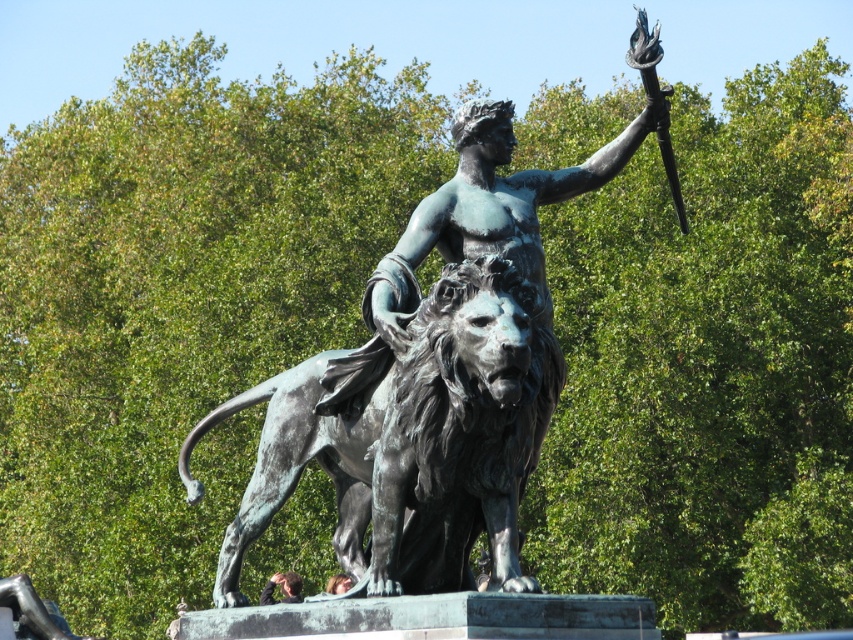
Question: Which of the following is the farthest from the observer?

Choices:
 (A) (456, 422)
 (B) (473, 244)

Answer: (B)

Question: Does bronze statue at center have a lesser width compared to bronze textured lion at center?

Choices:
 (A) yes
 (B) no

Answer: (B)

Question: Which point is closer to the camera?

Choices:
 (A) bronze statue at center
 (B) bronze textured lion at center

Answer: (B)

Question: Can you confirm if bronze statue at center is positioned to the left of bronze textured lion at center?

Choices:
 (A) no
 (B) yes

Answer: (A)

Question: Does bronze statue at center have a larger size compared to bronze textured lion at center?

Choices:
 (A) no
 (B) yes

Answer: (B)